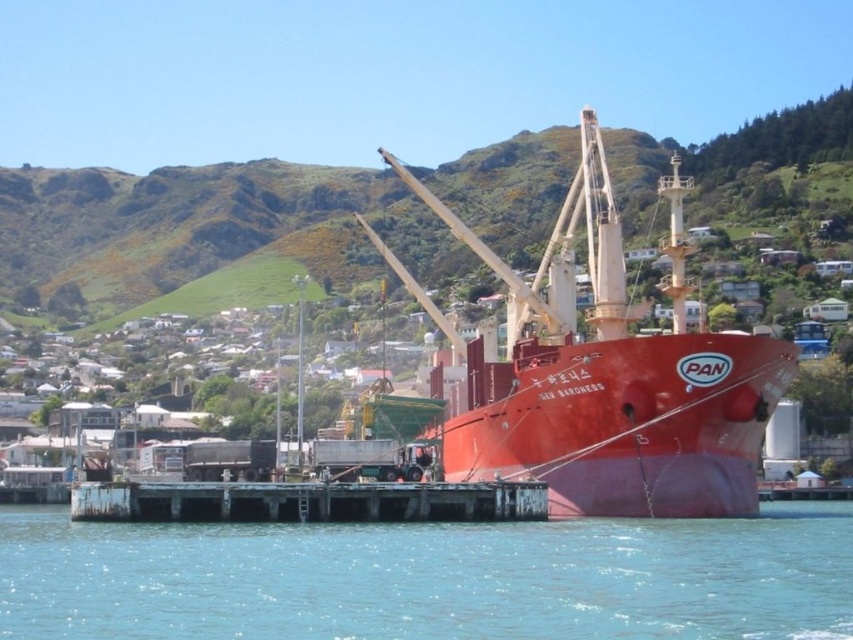
You are a crane operator on the PAN cargo ship. You need to lower a heavy container onto the rusty metal dock at lower center. However, there is clear blue water at lower center nearby. Based on the scene, where should you place the container to avoid dropping it into the water?

The clear blue water at lower center is below the rusty metal dock at lower center, so you should place the container on the rusty metal dock at lower center to avoid dropping it into the water.

You are a crane operator on the matte red ship at center. You need to lower a heavy container onto the rusty metal dock at lower center. Based on the scene, can you safely lower the container directly below your current position?

The matte red ship at center is positioned over the rusty metal dock at lower center, so yes, you can safely lower the container directly below your current position as the dock is directly beneath the ship.